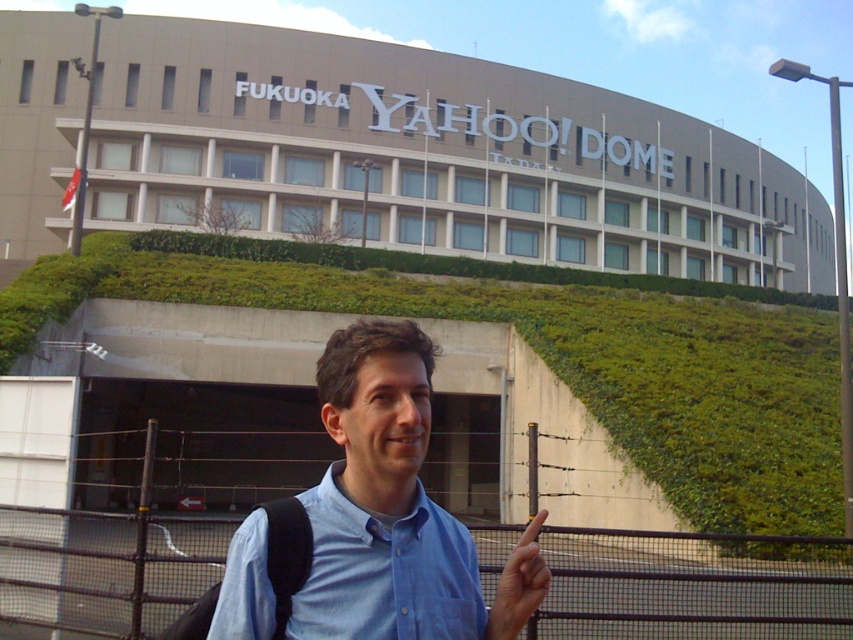
Does blue cotton shirt at center have a larger size compared to skinny finger at center?

No.

Between blue cotton shirt at center and skinny finger at center, which one appears on the right side from the viewer's perspective?

skinny finger at center

Is point (247, 627) behind point (540, 596)?

No, it is not.

The height and width of the screenshot is (640, 853). Find the location of `blue cotton shirt at center`. blue cotton shirt at center is located at coordinates (395, 509).

Which of these two, blue cotton shirt at lower center or skinny finger at center, stands taller?

skinny finger at center is taller.

Which of these two, blue cotton shirt at lower center or skinny finger at center, stands shorter?

blue cotton shirt at lower center

What are the coordinates of `blue cotton shirt at lower center` in the screenshot? It's located at (386, 572).

Image resolution: width=853 pixels, height=640 pixels. What are the coordinates of `blue cotton shirt at lower center` in the screenshot? It's located at (386, 572).

Can you confirm if blue cotton shirt at center is positioned below blue cotton shirt at lower center?

Indeed, blue cotton shirt at center is positioned under blue cotton shirt at lower center.

Between point (397, 404) and point (428, 502), which one is positioned in front?

Point (397, 404)

Who is more distant from viewer, [378,531] or [456,525]?

Point [456,525]

What are the coordinates of `blue cotton shirt at center` in the screenshot? It's located at coord(395,509).